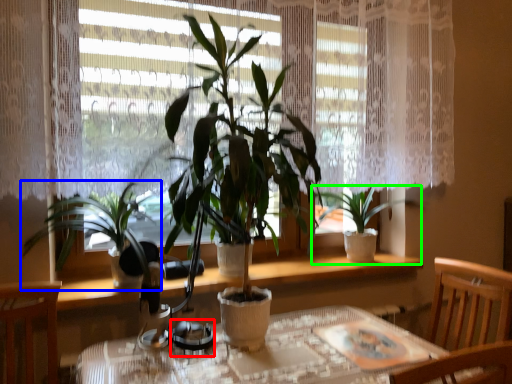
Question: Considering the real-world distances, which object is farthest from tableware (highlighted by a red box)? houseplant (highlighted by a blue box) or houseplant (highlighted by a green box)?

Choices:
 (A) houseplant
 (B) houseplant

Answer: (B)